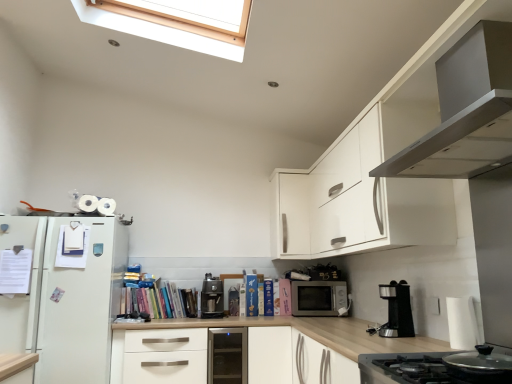
Question: Considering the positions of hardcover books at center and white matte drawer at center in the image, is hardcover books at center taller or shorter than white matte drawer at center?

Choices:
 (A) short
 (B) tall

Answer: (A)

Question: Relative to white matte drawer at center, is hardcover books at center in front or behind?

Choices:
 (A) front
 (B) behind

Answer: (B)

Question: Estimate the real-world distances between objects in this image. Which object is closer to the black plastic coffee machine at lower right, positioned as the first coffee machine in front-to-back order?

Choices:
 (A) satin silver range hood at upper right, which is the 1th home appliance from top to bottom
 (B) matte silver microwave at center
 (C) satin black coffee machine at center, marked as the second coffee machine in a right-to-left arrangement
 (D) white matte drawer at center
 (E) stainless steel stove at lower right, marked as the second home appliance in a top-to-bottom arrangement

Answer: (E)

Question: Based on their relative distances, which object is nearer to the stainless steel stove at lower right, which appears as the 1th home appliance when ordered from the bottom?

Choices:
 (A) hardcover books at center
 (B) satin black coffee machine at center, which is the 2th coffee machine in front-to-back order
 (C) matte silver microwave at center
 (D) white matte drawer at center
 (E) satin silver range hood at upper right, which is the 1th home appliance from top to bottom

Answer: (E)